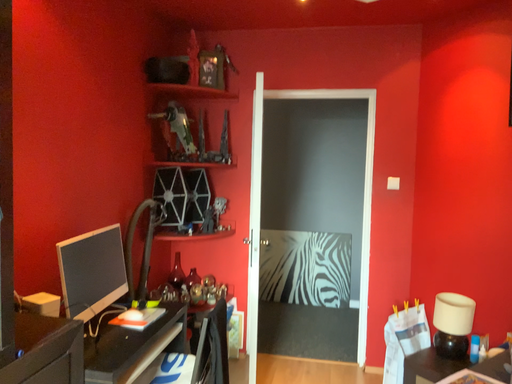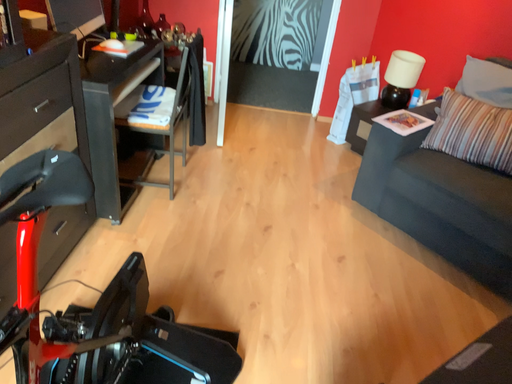
Question: How did the camera likely rotate when shooting the video?

Choices:
 (A) rotated upward
 (B) rotated downward

Answer: (B)